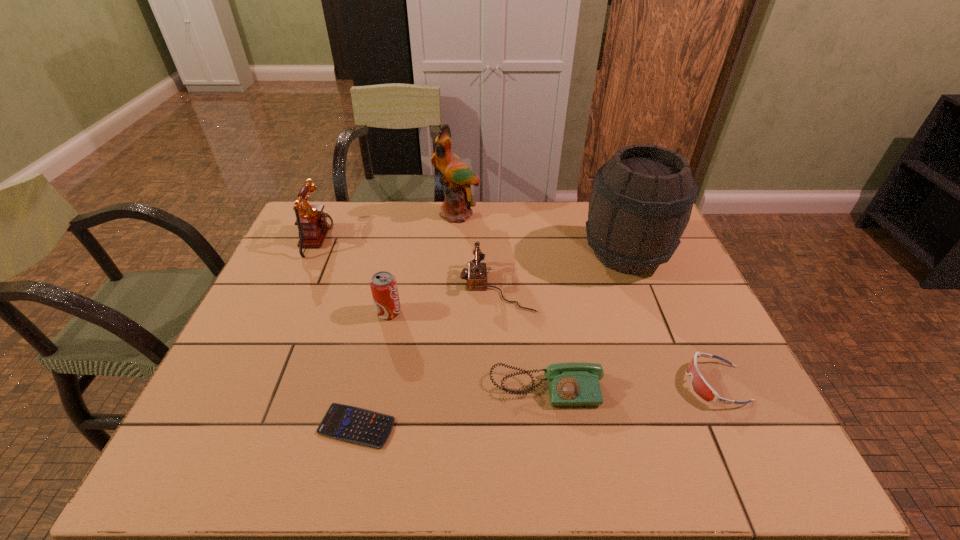
Identify which telephone is the second nearest to the shortest object. Please provide its 2D coordinates. Your answer should be formatted as a tuple, i.e. [(x, y)], where the tuple contains the x and y coordinates of a point satisfying the conditions above.

[(476, 275)]

Image resolution: width=960 pixels, height=540 pixels. Identify the location of free space that satisfies the following two spatial constraints: 1. on the dial of the soda can; 2. on the right side of the leftmost object. (286, 312).

Where is `free space in the image that satisfies the following two spatial constraints: 1. on the dial of the leftmost telephone; 2. on the back side of the wine bucket`? Image resolution: width=960 pixels, height=540 pixels. free space in the image that satisfies the following two spatial constraints: 1. on the dial of the leftmost telephone; 2. on the back side of the wine bucket is located at coordinates (312, 254).

Find the location of a particular element. The image size is (960, 540). vacant point that satisfies the following two spatial constraints: 1. on the front-facing side of the wine bucket; 2. on the left side of the parrot is located at coordinates (454, 254).